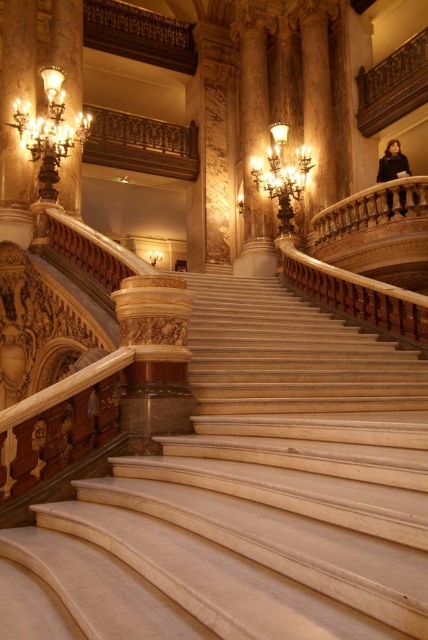
Who is lower down, carved wood balustrade at upper center or gold metallic chandelier at upper left?

gold metallic chandelier at upper left is lower down.

Consider the image. Does carved wood balustrade at upper center appear under gold metallic chandelier at upper left?

No.

Where is `carved wood balustrade at upper center`? The width and height of the screenshot is (428, 640). carved wood balustrade at upper center is located at coordinates pos(142,145).

The image size is (428, 640). What are the coordinates of `carved wood balustrade at upper center` in the screenshot? It's located at (142, 145).

Is carved wood balustrade at upper center wider than matte bronze sconce at upper left?

In fact, carved wood balustrade at upper center might be narrower than matte bronze sconce at upper left.

Can you confirm if carved wood balustrade at upper center is positioned below matte bronze sconce at upper left?

Yes, carved wood balustrade at upper center is below matte bronze sconce at upper left.

At what (x,y) coordinates should I click in order to perform the action: click on carved wood balustrade at upper center. Please return your answer as a coordinate pair (x, y). This screenshot has height=640, width=428. Looking at the image, I should click on (142, 145).

At what (x,y) coordinates should I click in order to perform the action: click on carved wood balustrade at upper center. Please return your answer as a coordinate pair (x, y). Looking at the image, I should click on (142, 145).

Is matte bronze sconce at upper left shorter than gold metallic chandelier at upper center?

No, matte bronze sconce at upper left is not shorter than gold metallic chandelier at upper center.

Does matte bronze sconce at upper left appear on the right side of gold metallic chandelier at upper center?

In fact, matte bronze sconce at upper left is to the left of gold metallic chandelier at upper center.

Describe the element at coordinates (68, 51) in the screenshot. I see `matte bronze sconce at upper left` at that location.

Find the location of a particular element. matte bronze sconce at upper left is located at coordinates (68, 51).